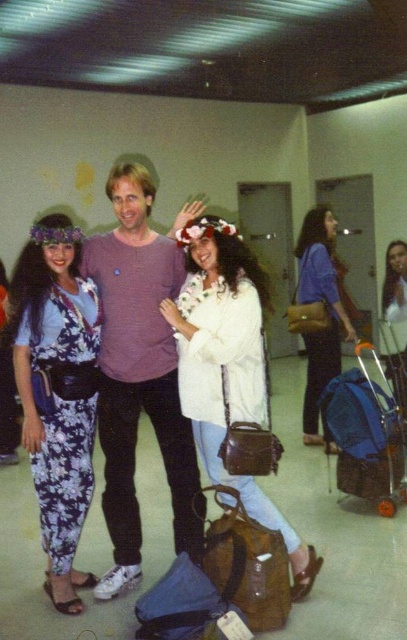
Question: Considering the relative positions of floral print jumpsuit at left and matte brown purse at center in the image provided, where is floral print jumpsuit at left located with respect to matte brown purse at center?

Choices:
 (A) below
 (B) above

Answer: (A)

Question: Does floral print jumpsuit at left appear on the left side of matte brown purse at center?

Choices:
 (A) yes
 (B) no

Answer: (A)

Question: Among these points, which one is nearest to the camera?

Choices:
 (A) (72, 612)
 (B) (367, 492)
 (C) (336, 321)
 (D) (249, 488)

Answer: (A)

Question: Does blue fabric suitcase at lower right appear on the right side of matte brown purse at center?

Choices:
 (A) yes
 (B) no

Answer: (A)

Question: Which point is farther to the camera?

Choices:
 (A) white matte sweater at center
 (B) floral print jumpsuit at left
 (C) blue fabric suitcase at lower right
 (D) purple cotton shirt at center

Answer: (C)

Question: Which of these objects is positioned closest to the matte brown purse at center?

Choices:
 (A) white matte sweater at center
 (B) floral print jumpsuit at left

Answer: (A)